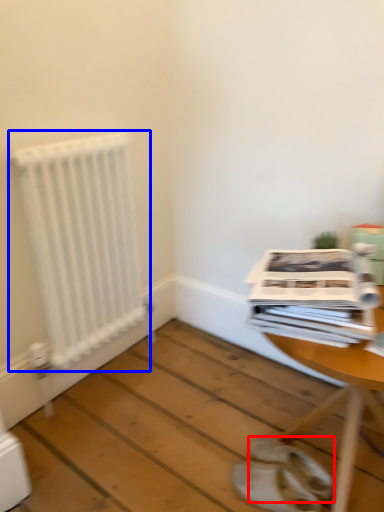
Question: Which object appears farthest to the camera in this image, footwear (highlighted by a red box) or radiator (highlighted by a blue box)?

Choices:
 (A) footwear
 (B) radiator

Answer: (B)